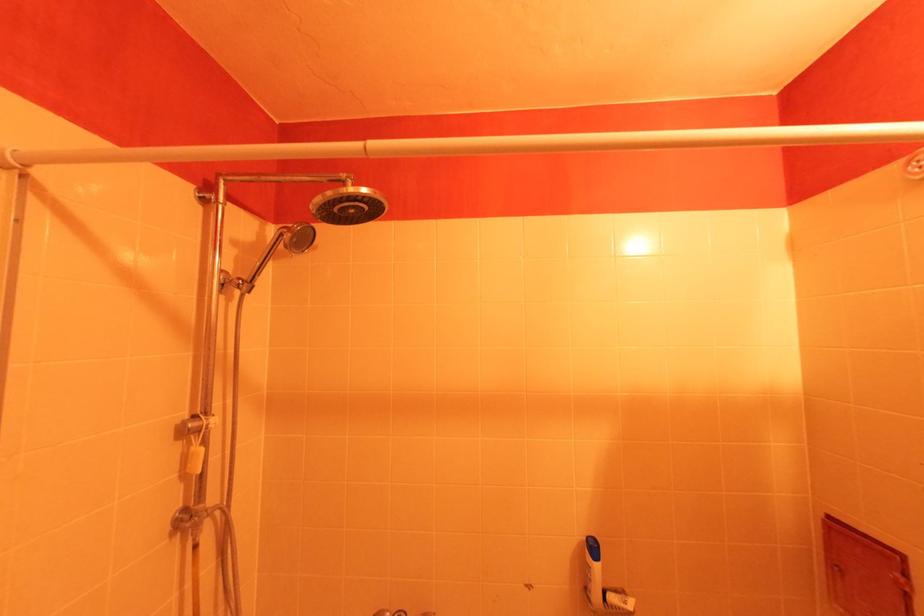
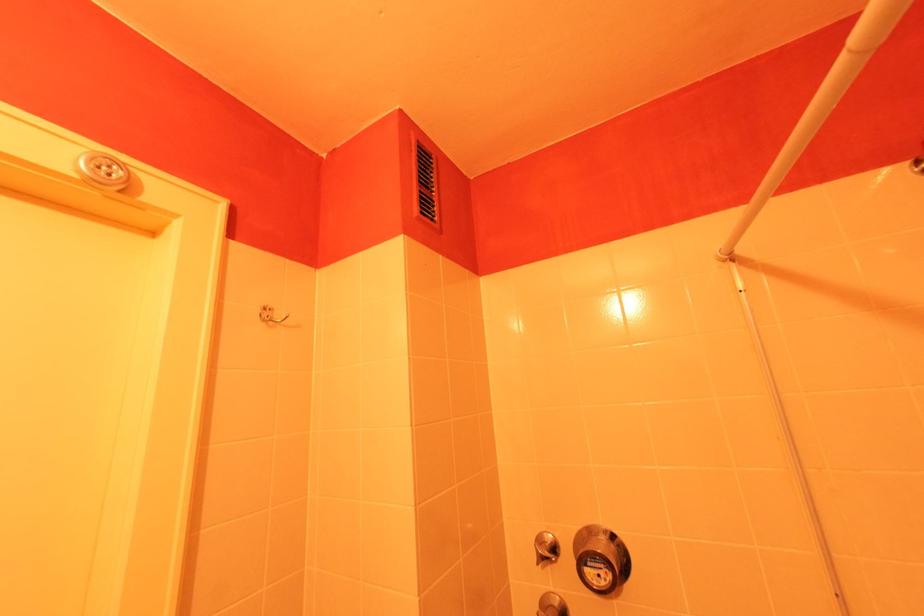
Consider the image. The first image is from the beginning of the video and the second image is from the end. How did the camera likely rotate when shooting the video?

The camera rotated toward left-up.